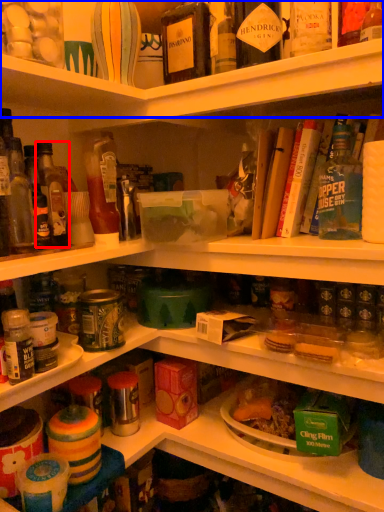
Question: Which object is further to the camera taking this photo, bottle (highlighted by a red box) or shelf (highlighted by a blue box)?

Choices:
 (A) bottle
 (B) shelf

Answer: (A)